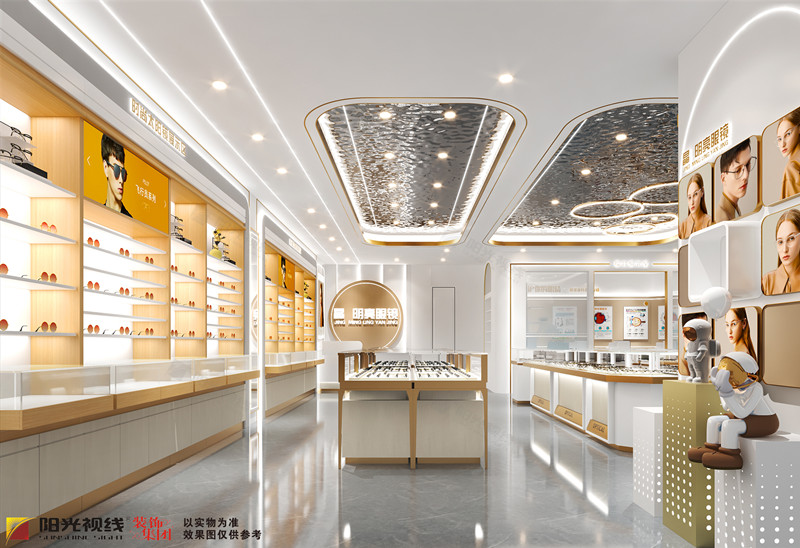
Where is `display stand in center of image`? This screenshot has width=800, height=548. display stand in center of image is located at coordinates (410, 399).